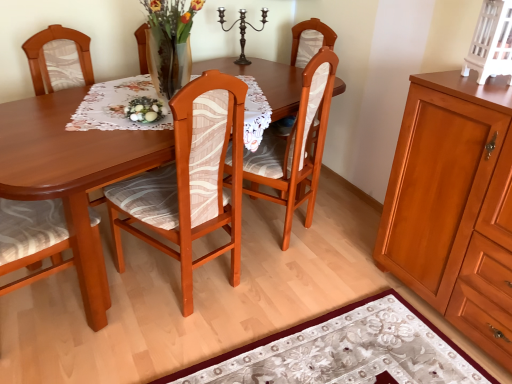
Question: Does wooden chair at center, which is the 1th chair in left-to-right order, have a greater width compared to matte wood cabinet at right, placed as the second cabinetry when sorted from top to bottom?

Choices:
 (A) no
 (B) yes

Answer: (A)

Question: Can you confirm if wooden chair at center, which is the 1th chair in left-to-right order, is smaller than matte wood cabinet at right, the first cabinetry in the bottom-to-top sequence?

Choices:
 (A) yes
 (B) no

Answer: (A)

Question: Is wooden chair at center, positioned as the third chair in right-to-left order, taller than matte wood cabinet at right, placed as the second cabinetry when sorted from top to bottom?

Choices:
 (A) no
 (B) yes

Answer: (B)

Question: Is wooden chair at center, positioned as the third chair in right-to-left order, facing away from matte wood cabinet at right, the first cabinetry in the bottom-to-top sequence?

Choices:
 (A) yes
 (B) no

Answer: (B)

Question: Can you confirm if wooden chair at center, which is the 1th chair in left-to-right order, is positioned to the left of matte wood cabinet at right, placed as the second cabinetry when sorted from top to bottom?

Choices:
 (A) no
 (B) yes

Answer: (B)

Question: From their relative heights in the image, would you say dark brown metal candle holder at upper center is taller or shorter than white glossy eggs at center?

Choices:
 (A) short
 (B) tall

Answer: (B)

Question: Considering the positions of dark brown metal candle holder at upper center and white glossy eggs at center in the image, is dark brown metal candle holder at upper center wider or thinner than white glossy eggs at center?

Choices:
 (A) wide
 (B) thin

Answer: (B)

Question: Is dark brown metal candle holder at upper center spatially inside white glossy eggs at center, or outside of it?

Choices:
 (A) outside
 (B) inside

Answer: (A)

Question: Is dark brown metal candle holder at upper center to the left or to the right of white glossy eggs at center in the image?

Choices:
 (A) right
 (B) left

Answer: (A)

Question: Which is correct: floral-patterned fabric at lower center is inside white painted wood cabinet at upper right, the first cabinetry in the top-to-bottom sequence, or outside of it?

Choices:
 (A) inside
 (B) outside

Answer: (B)

Question: Based on their positions, is floral-patterned fabric at lower center located to the left or right of white painted wood cabinet at upper right, the first cabinetry in the top-to-bottom sequence?

Choices:
 (A) right
 (B) left

Answer: (B)

Question: From the image's perspective, is floral-patterned fabric at lower center located above or below white painted wood cabinet at upper right, the first cabinetry in the top-to-bottom sequence?

Choices:
 (A) above
 (B) below

Answer: (B)

Question: From a real-world perspective, is floral-patterned fabric at lower center physically located above or below white painted wood cabinet at upper right, the first cabinetry in the top-to-bottom sequence?

Choices:
 (A) above
 (B) below

Answer: (B)

Question: From the image's perspective, is matte wood cabinet at right, placed as the second cabinetry when sorted from top to bottom, positioned above or below wooden chair at center, which is the 1th chair in left-to-right order?

Choices:
 (A) above
 (B) below

Answer: (B)

Question: Considering their positions, is matte wood cabinet at right, placed as the second cabinetry when sorted from top to bottom, located in front of or behind wooden chair at center, which is the 1th chair in left-to-right order?

Choices:
 (A) front
 (B) behind

Answer: (A)